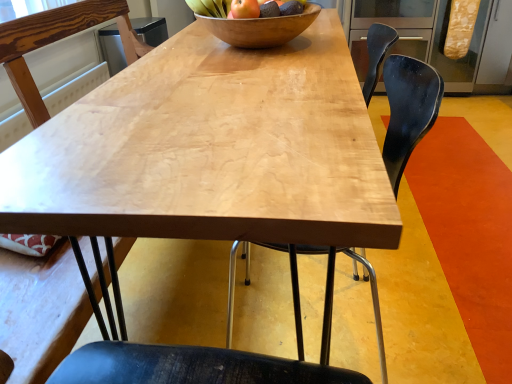
Question: Considering their positions, is wooden bowl at center located in front of or behind shiny wooden bowl at upper center?

Choices:
 (A) behind
 (B) front

Answer: (B)

Question: Visually, is wooden bowl at center positioned to the left or to the right of shiny wooden bowl at upper center?

Choices:
 (A) right
 (B) left

Answer: (A)

Question: Which object is the farthest from the shiny wooden bowl at upper center?

Choices:
 (A) black matte chair at center, placed as the 2th chair when sorted from right to left
 (B) wooden bowl at center
 (C) black plastic chair at center, which is counted as the third chair, starting from the left
 (D) matte black chair at lower center, which is the 3th chair from right to left
 (E) matte brown apple at center

Answer: (A)

Question: Estimate the real-world distances between objects in this image. Which object is closer to the wooden bowl at center?

Choices:
 (A) black matte chair at center, which is counted as the second chair, starting from the left
 (B) matte brown apple at center
 (C) matte black chair at lower center, positioned as the first chair in left-to-right order
 (D) black plastic chair at center, the 1th chair in the right-to-left sequence
 (E) shiny wooden bowl at upper center

Answer: (E)